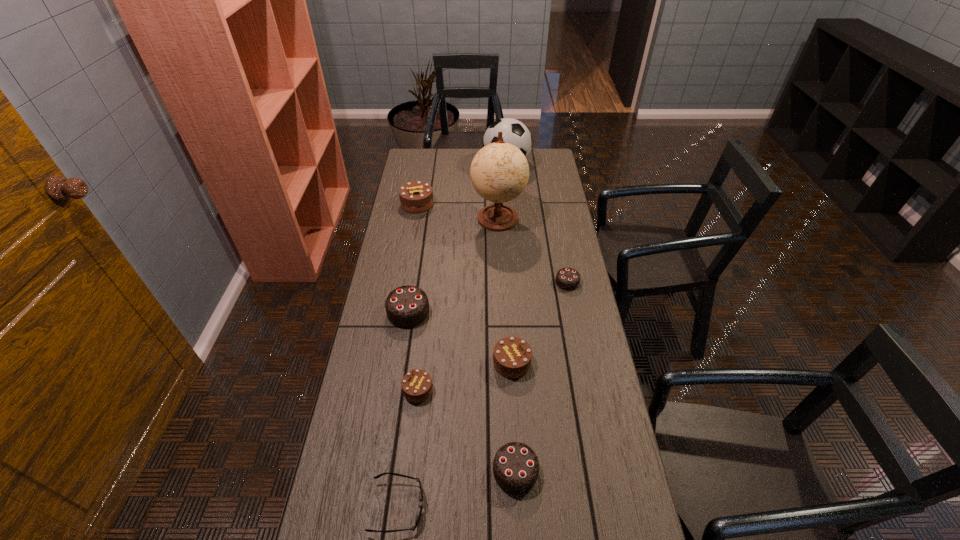
Locate an element on the screen. The width and height of the screenshot is (960, 540). globe is located at coordinates (499, 172).

Image resolution: width=960 pixels, height=540 pixels. What are the coordinates of `the tallest object` in the screenshot? It's located at (499, 172).

This screenshot has height=540, width=960. Identify the location of soccer ball. (515, 132).

This screenshot has width=960, height=540. Identify the location of black soccer ball. (515, 132).

Locate an element on the screen. the farthest brown chocolate cake is located at coordinates (416, 196).

This screenshot has width=960, height=540. What are the coordinates of `the biggest brown chocolate cake` in the screenshot? It's located at (416, 196).

Identify the location of the fifth nearest object. (407, 306).

I want to click on the fourth nearest chocolate cake, so point(407,306).

Find the location of a particular element. The height and width of the screenshot is (540, 960). the rightmost brown chocolate cake is located at coordinates (512, 356).

At what (x,y) coordinates should I click in order to perform the action: click on the second chocolate chocolate cake from right to left. Please return your answer as a coordinate pair (x, y). Looking at the image, I should click on (515, 467).